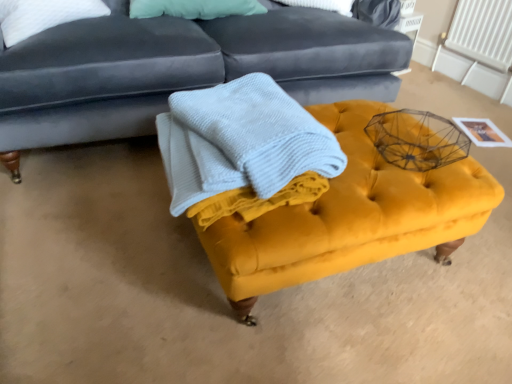
You are a GUI agent. You are given a task and a screenshot of the screen. Output one action in this format:
    pyautogui.click(x=<x>, y=<y>)
    Task: Click on the vacant space that is to the left of velvet yellow ottoman at center
    The width and height of the screenshot is (512, 384).
    Given the screenshot: What is the action you would take?
    pyautogui.click(x=100, y=239)